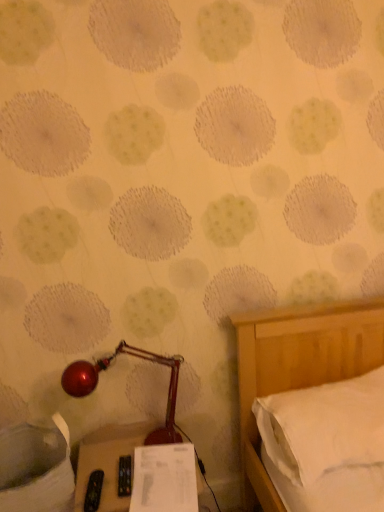
Locate an element on the screen. free spot below white paper at lower center (from a real-world perspective) is located at coordinates (162, 500).